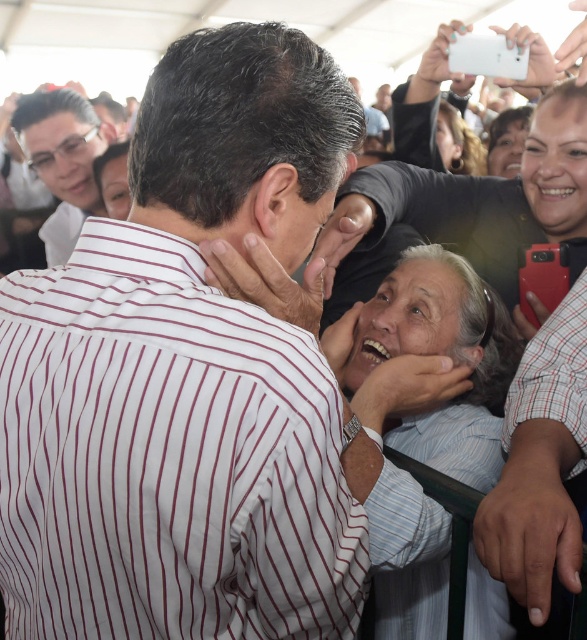
Question: Can you confirm if light blue striped shirt at center is positioned to the right of matte black glasses at upper left?

Choices:
 (A) yes
 (B) no

Answer: (A)

Question: Estimate the real-world distances between objects in this image. Which object is farther from the light blue striped shirt at center?

Choices:
 (A) matte black glasses at upper left
 (B) white striped shirt at center

Answer: (A)

Question: Which point appears farthest from the camera in this image?

Choices:
 (A) (433, 392)
 (B) (89, 444)
 (C) (65, 132)

Answer: (C)

Question: Which point appears farthest from the camera in this image?

Choices:
 (A) (258, 476)
 (B) (52, 116)

Answer: (B)

Question: Can you confirm if white striped shirt at center is positioned to the left of light blue striped shirt at center?

Choices:
 (A) yes
 (B) no

Answer: (A)

Question: Does white striped shirt at center appear on the right side of light blue striped shirt at center?

Choices:
 (A) yes
 (B) no

Answer: (B)